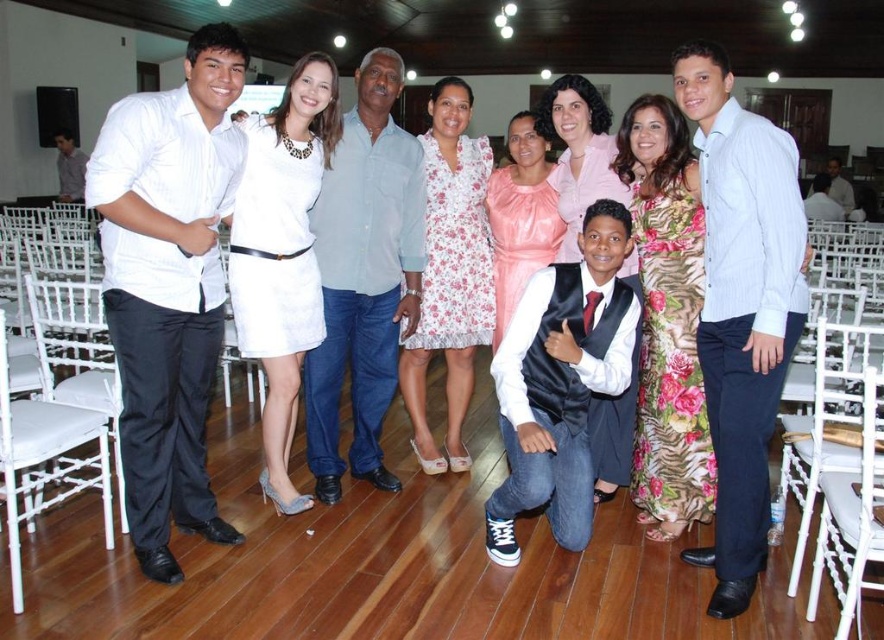
Between light blue denim jeans at center and light blue shirt at center, which one appears on the right side from the viewer's perspective?

light blue shirt at center is more to the right.

Can you confirm if light blue denim jeans at center is taller than light blue shirt at center?

Indeed, light blue denim jeans at center has a greater height compared to light blue shirt at center.

What do you see at coordinates (363, 276) in the screenshot?
I see `light blue denim jeans at center` at bounding box center [363, 276].

In order to click on light blue denim jeans at center in this screenshot , I will do `click(363, 276)`.

Who is more forward, (616,276) or (264,362)?

Point (264,362)

Is satin black vest at center taller than white satin dress at center?

No.

Measure the distance between point (508, 333) and camera.

The distance of point (508, 333) from camera is 2.96 meters.

I want to click on satin black vest at center, so click(561, 381).

Who is positioned more to the left, white striped shirt at right or pink satin dress at center?

pink satin dress at center is more to the left.

Does white striped shirt at right have a larger size compared to pink satin dress at center?

Correct, white striped shirt at right is larger in size than pink satin dress at center.

Between point (726, 472) and point (520, 204), which one is positioned behind?

Point (520, 204)

I want to click on white striped shirt at right, so click(741, 307).